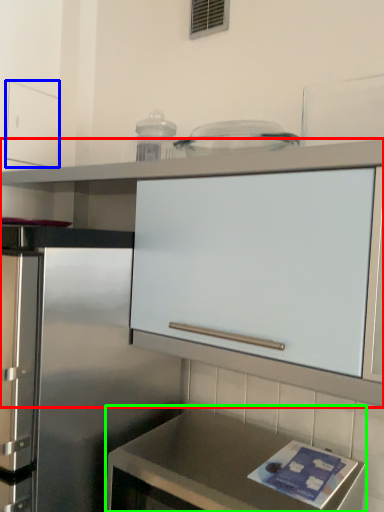
Question: Considering the real-world distances, which object is closest to cabinetry (highlighted by a red box)? drawer (highlighted by a blue box) or countertop (highlighted by a green box).

Choices:
 (A) drawer
 (B) countertop

Answer: (A)